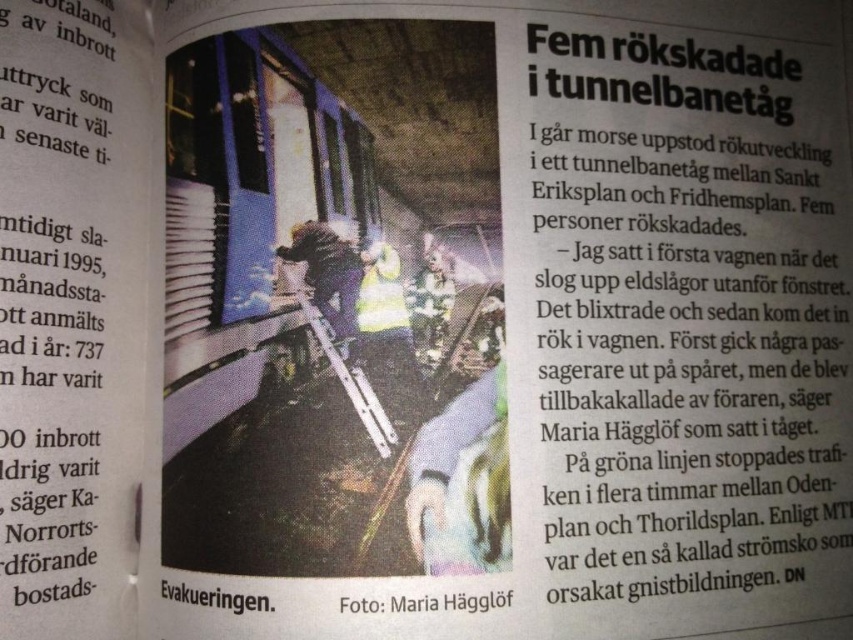
Which is above, blacktextured fabricphoto at center or black paper at lower center?

blacktextured fabricphoto at center

Based on the photo, can you confirm if blacktextured fabricphoto at center is positioned above black paper at lower center?

Yes, blacktextured fabricphoto at center is above black paper at lower center.

Identify the location of blacktextured fabricphoto at center. The image size is (853, 640). (428, 602).

Is white paper at upper center closer to the viewer compared to blacktextured fabricphoto at center?

That is False.

Find the location of a particular element. white paper at upper center is located at coordinates (692, 314).

You are a GUI agent. You are given a task and a screenshot of the screen. Output one action in this format:
    pyautogui.click(x=<x>, y=<y>)
    Task: Click on the white paper at upper center
    This screenshot has height=640, width=853.
    Given the screenshot: What is the action you would take?
    pyautogui.click(x=692, y=314)

Which is more to the right, white paper at upper center or black paper at lower center?

white paper at upper center is more to the right.

Find the location of a particular element. The width and height of the screenshot is (853, 640). white paper at upper center is located at coordinates (692, 314).

Image resolution: width=853 pixels, height=640 pixels. I want to click on white paper at upper center, so click(x=692, y=314).

Find the location of a particular element. white paper at upper center is located at coordinates (692, 314).